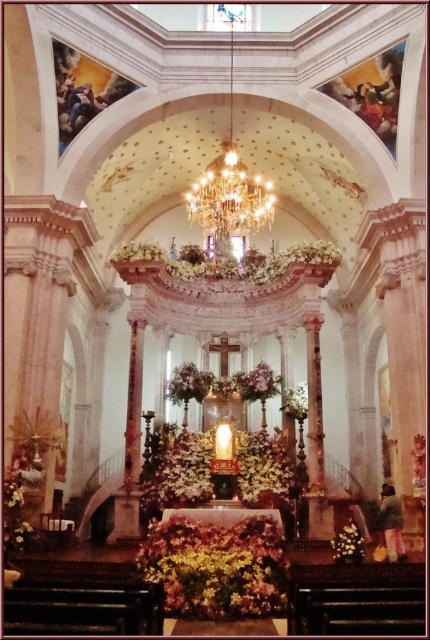
You are standing at the entrance of the grand church and want to place a small candle on the floor near the shiny gold flower at lower right. Based on the coordinates provided, where should you place the candle in relation to the flower?

The shiny gold flower at lower right is located at coordinates point (347,545). You should place the candle near that point on the floor.